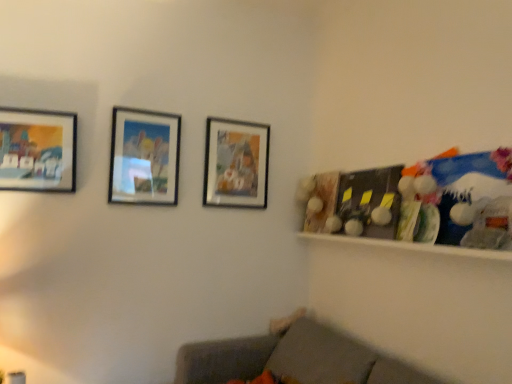
Question: Does matte wooden picture frame at center, which is counted as the 3th picture frame, starting from the front, have a greater width compared to matte glass picture frame at center, which appears as the 2th picture frame when viewed from the back?

Choices:
 (A) yes
 (B) no

Answer: (A)

Question: Is matte wooden picture frame at center, marked as the 1th picture frame in a back-to-front arrangement, closer to the viewer compared to matte glass picture frame at center, which is counted as the second picture frame, starting from the left?

Choices:
 (A) yes
 (B) no

Answer: (B)

Question: From the image's perspective, is matte wooden picture frame at center, marked as the 1th picture frame in a back-to-front arrangement, beneath matte glass picture frame at center, which is counted as the second picture frame, starting from the left?

Choices:
 (A) no
 (B) yes

Answer: (B)

Question: Would you say matte wooden picture frame at center, acting as the 1th picture frame starting from the right, is outside matte glass picture frame at center, acting as the 2th picture frame starting from the front?

Choices:
 (A) no
 (B) yes

Answer: (B)

Question: Does matte wooden picture frame at center, marked as the 1th picture frame in a back-to-front arrangement, come behind matte glass picture frame at center, which appears as the 2th picture frame when viewed from the back?

Choices:
 (A) yes
 (B) no

Answer: (A)

Question: Is gray fabric couch at lower center inside the boundaries of white glossy shelf at right, or outside?

Choices:
 (A) inside
 (B) outside

Answer: (B)

Question: Visually, is gray fabric couch at lower center positioned to the left or to the right of white glossy shelf at right?

Choices:
 (A) right
 (B) left

Answer: (B)

Question: From the image's perspective, is gray fabric couch at lower center positioned above or below white glossy shelf at right?

Choices:
 (A) below
 (B) above

Answer: (A)

Question: Looking at the image, does gray fabric couch at lower center seem bigger or smaller compared to white glossy shelf at right?

Choices:
 (A) big
 (B) small

Answer: (A)

Question: From the image's perspective, is matte wooden picture frame at center, acting as the 1th picture frame starting from the right, positioned above or below gray fabric couch at lower center?

Choices:
 (A) below
 (B) above

Answer: (B)

Question: Is matte wooden picture frame at center, marked as the 1th picture frame in a back-to-front arrangement, inside the boundaries of gray fabric couch at lower center, or outside?

Choices:
 (A) inside
 (B) outside

Answer: (B)

Question: Based on their sizes in the image, would you say matte wooden picture frame at center, marked as the 3th picture frame in a left-to-right arrangement, is bigger or smaller than gray fabric couch at lower center?

Choices:
 (A) big
 (B) small

Answer: (B)

Question: From a real-world perspective, is matte wooden picture frame at center, acting as the 1th picture frame starting from the right, physically located above or below gray fabric couch at lower center?

Choices:
 (A) above
 (B) below

Answer: (A)

Question: From a real-world perspective, is matte glass picture frame at center, acting as the 2th picture frame starting from the front, positioned above or below gray fabric couch at lower center?

Choices:
 (A) below
 (B) above

Answer: (B)

Question: Considering the relative positions of matte glass picture frame at center, which is counted as the second picture frame, starting from the left, and gray fabric couch at lower center in the image provided, is matte glass picture frame at center, which is counted as the second picture frame, starting from the left, to the left or to the right of gray fabric couch at lower center?

Choices:
 (A) right
 (B) left

Answer: (B)